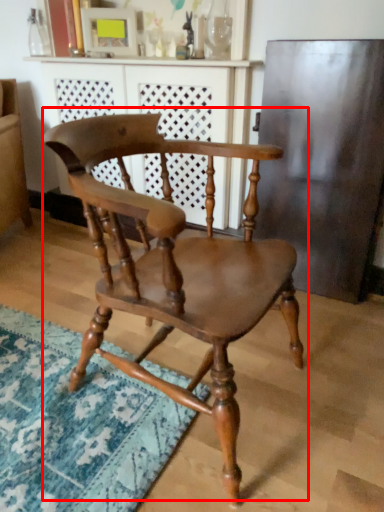
Question: From the image's perspective, where is chair (annotated by the red box) located in relation to dresser in the image?

Choices:
 (A) below
 (B) above

Answer: (A)